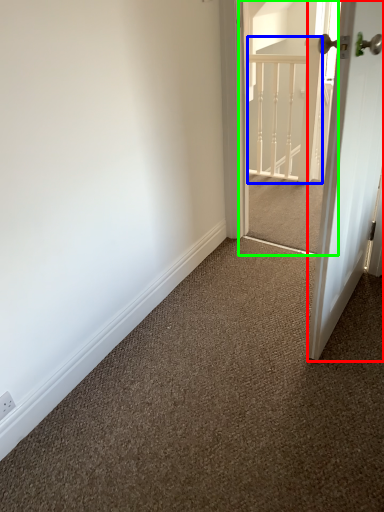
Question: Which object is the closest to the door (highlighted by a red box)? Choose among these: rail (highlighted by a blue box) or screen door (highlighted by a green box).

Choices:
 (A) rail
 (B) screen door

Answer: (B)